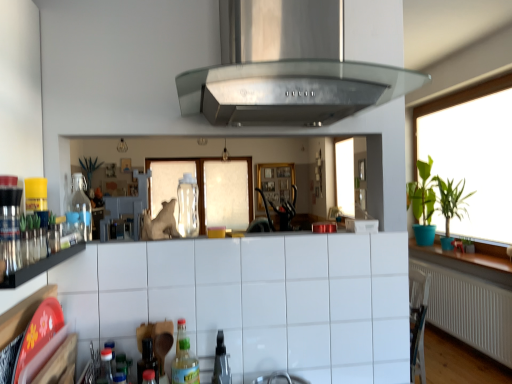
Question: Based on their positions, is green matte plant at right, positioned as the first plant in front-to-back order, located to the left or right of translucent plastic bottle at lower center, the third bottle from the back?

Choices:
 (A) left
 (B) right

Answer: (B)

Question: In terms of width, does green matte plant at right, positioned as the second plant in back-to-front order, look wider or thinner when compared to translucent plastic bottle at lower center, placed as the 1th bottle when sorted from bottom to top?

Choices:
 (A) thin
 (B) wide

Answer: (B)

Question: Which object is positioned farthest from the black glass shelf at left?

Choices:
 (A) translucent plastic bottle at lower center, placed as the 1th bottle when sorted from bottom to top
 (B) green leafy plant at right
 (C) white tile cabinetry at lower center
 (D) clear glass bottle at left, the 2th bottle positioned from the top
 (E) transparent glass bottle at center, which appears as the 2th bottle when viewed from the left

Answer: (B)

Question: Which object is the farthest from the stainless steel exhaust hood at center?

Choices:
 (A) transparent glass bottle at center, which appears as the 2th bottle when viewed from the left
 (B) black glass shelf at left
 (C) white tile cabinetry at lower center
 (D) clear plastic spray bottle at center
 (E) green leafy plant at right, which is counted as the 1th plant, starting from the back

Answer: (E)